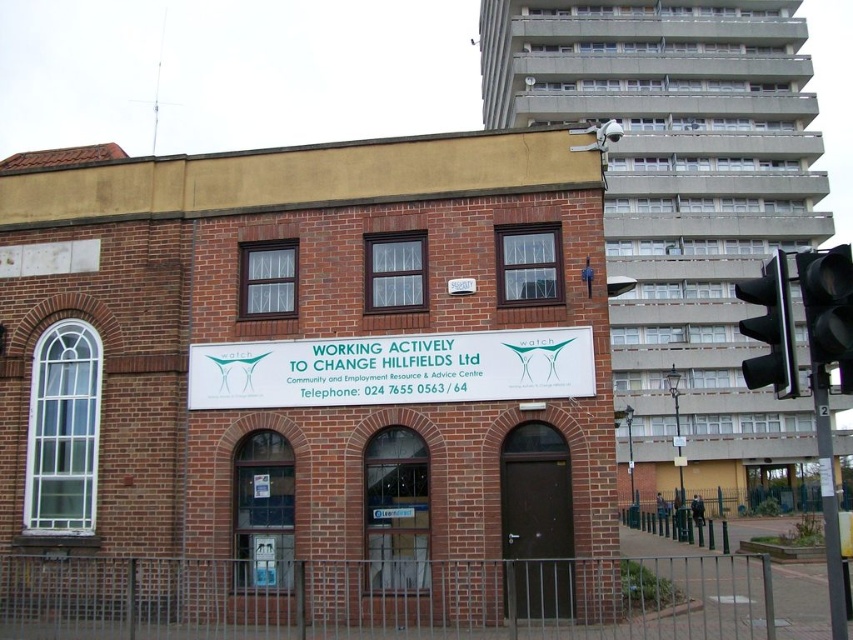
Is white plastic sign at center taller than black plastic traffic light at right?

In fact, white plastic sign at center may be shorter than black plastic traffic light at right.

The height and width of the screenshot is (640, 853). In order to click on white plastic sign at center in this screenshot , I will do `click(393, 369)`.

Between point (199, 401) and point (764, 280), which one is positioned in front?

Positioned in front is point (764, 280).

What are the coordinates of `white plastic sign at center` in the screenshot? It's located at (393, 369).

Is black plastic traffic light at right taller than black metal traffic light at right?

Yes.

Between black plastic traffic light at right and black metal traffic light at right, which one is positioned lower?

black metal traffic light at right is below.

Does point (740, 289) lie behind point (831, 621)?

No, it is not.

Find the location of `black plastic traffic light at right`. black plastic traffic light at right is located at coordinates (770, 330).

Is white plastic sign at center to the left of black metal traffic light at right from the viewer's perspective?

Correct, you'll find white plastic sign at center to the left of black metal traffic light at right.

Which is behind, point (534, 336) or point (842, 570)?

Positioned behind is point (534, 336).

Image resolution: width=853 pixels, height=640 pixels. I want to click on white plastic sign at center, so click(x=393, y=369).